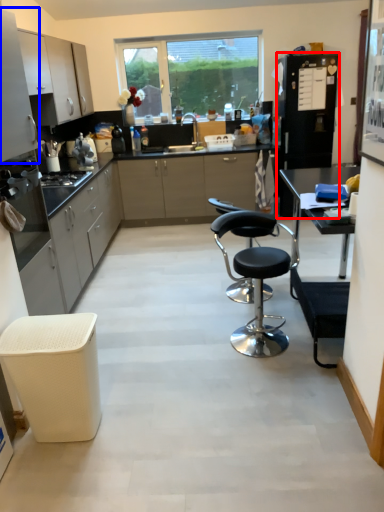
Question: Among these objects, which one is nearest to the camera, appliance (highlighted by a red box) or cabinetry (highlighted by a blue box)?

Choices:
 (A) appliance
 (B) cabinetry

Answer: (B)